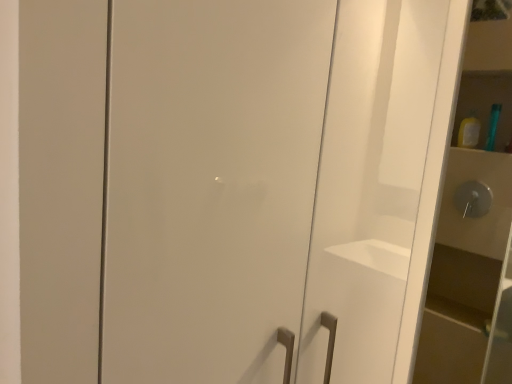
Question: From a real-world perspective, is matte white cabinet at right positioned over green plastic toothbrush at upper right based on gravity?

Choices:
 (A) no
 (B) yes

Answer: (A)

Question: Does matte white cabinet at right have a lesser height compared to green plastic toothbrush at upper right?

Choices:
 (A) yes
 (B) no

Answer: (B)

Question: Is matte white cabinet at right taller than green plastic toothbrush at upper right?

Choices:
 (A) no
 (B) yes

Answer: (B)

Question: From a real-world perspective, is matte white cabinet at right positioned under green plastic toothbrush at upper right based on gravity?

Choices:
 (A) yes
 (B) no

Answer: (A)

Question: Can you confirm if matte white cabinet at right is wider than green plastic toothbrush at upper right?

Choices:
 (A) yes
 (B) no

Answer: (B)

Question: Does matte white cabinet at right have a smaller size compared to green plastic toothbrush at upper right?

Choices:
 (A) yes
 (B) no

Answer: (B)

Question: Is green plastic toothbrush at upper right beside glossy white cabinet at center?

Choices:
 (A) yes
 (B) no

Answer: (B)

Question: Considering the relative sizes of green plastic toothbrush at upper right and glossy white cabinet at center in the image provided, is green plastic toothbrush at upper right thinner than glossy white cabinet at center?

Choices:
 (A) no
 (B) yes

Answer: (A)

Question: Is green plastic toothbrush at upper right bigger than glossy white cabinet at center?

Choices:
 (A) no
 (B) yes

Answer: (A)

Question: Considering the relative positions of green plastic toothbrush at upper right and glossy white cabinet at center in the image provided, is green plastic toothbrush at upper right to the right of glossy white cabinet at center from the viewer's perspective?

Choices:
 (A) no
 (B) yes

Answer: (B)

Question: Would you say green plastic toothbrush at upper right is a long distance from glossy white cabinet at center?

Choices:
 (A) yes
 (B) no

Answer: (A)

Question: From a real-world perspective, is green plastic toothbrush at upper right on glossy white cabinet at center?

Choices:
 (A) no
 (B) yes

Answer: (B)

Question: Is glossy white cabinet at center completely or partially outside of green plastic toothbrush at upper right?

Choices:
 (A) no
 (B) yes

Answer: (B)